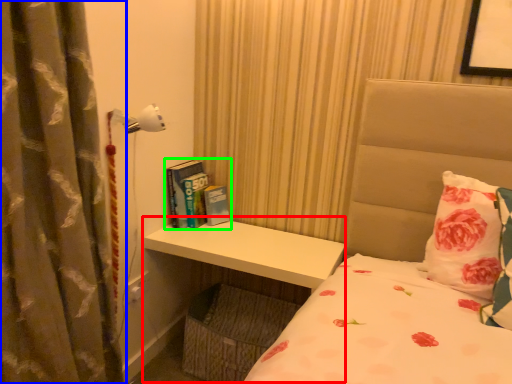
Question: Which object is positioned closest to table (highlighted by a red box)? Select from curtain (highlighted by a blue box) and book (highlighted by a green box).

Choices:
 (A) curtain
 (B) book

Answer: (B)